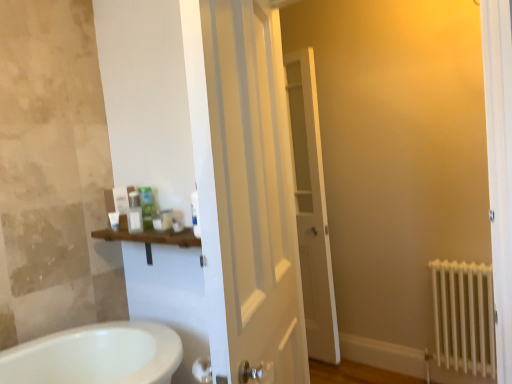
Question: Does point (130, 211) appear closer or farther from the camera than point (178, 225)?

Choices:
 (A) closer
 (B) farther

Answer: (B)

Question: Considering their positions, is matte plastic container at center, the 4th toiletry when ordered from right to left, located in front of or behind matte white container at center, which is the fifth toiletry in left-to-right order?

Choices:
 (A) behind
 (B) front

Answer: (A)

Question: Considering the real-world distances, which object is farthest from the white matte radiator at lower right?

Choices:
 (A) translucent plastic container at upper center, which is the 4th toiletry from left to right
 (B) matte white container at left, placed as the fifth toiletry when sorted from right to left
 (C) white glossy door at center, marked as the second door in a front-to-back arrangement
 (D) matte plastic container at center, the 4th toiletry when ordered from right to left
 (E) matte green bottle at upper left, which appears as the third toiletry when viewed from the left

Answer: (B)

Question: Which is nearer to the translucent plastic container at upper center, which is the 4th toiletry from left to right?

Choices:
 (A) white matte radiator at lower right
 (B) matte white container at left, placed as the fifth toiletry when sorted from right to left
 (C) matte white container at center, which is the fifth toiletry in left-to-right order
 (D) matte green bottle at upper left, which appears as the third toiletry when viewed from the left
 (E) white glossy door at center, the first door viewed from the back

Answer: (C)